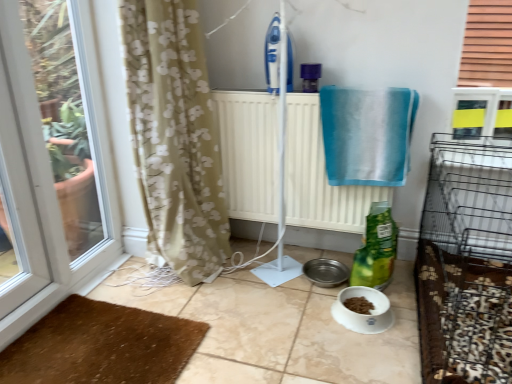
The height and width of the screenshot is (384, 512). Find the location of `free spot behind brown textured mat at lower left`. free spot behind brown textured mat at lower left is located at coordinates click(150, 290).